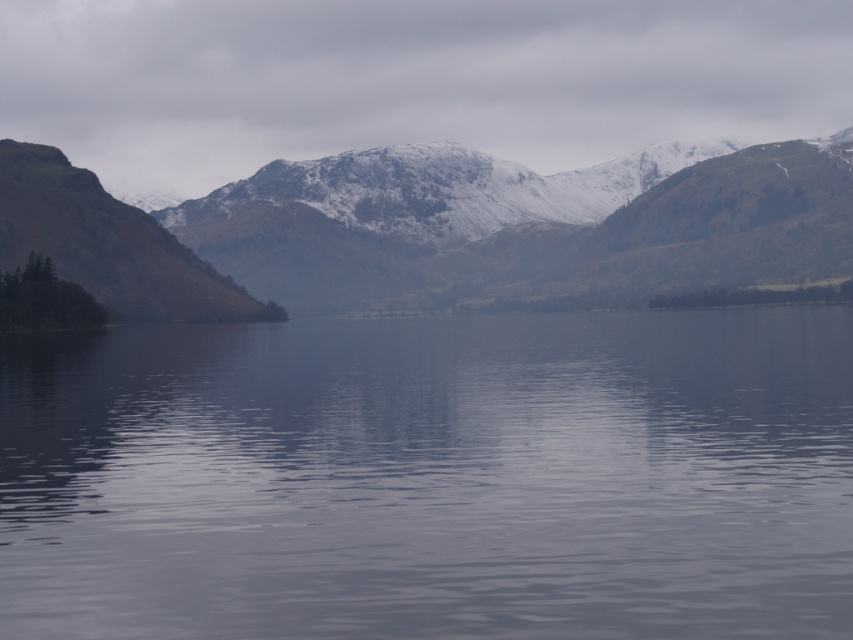
Between smooth gray water at center and snow-covered mountain at upper center, which one is positioned lower?

smooth gray water at center is below.

Can you confirm if smooth gray water at center is bigger than snow-covered mountain at upper center?

Yes.

Image resolution: width=853 pixels, height=640 pixels. What are the coordinates of `smooth gray water at center` in the screenshot? It's located at (431, 476).